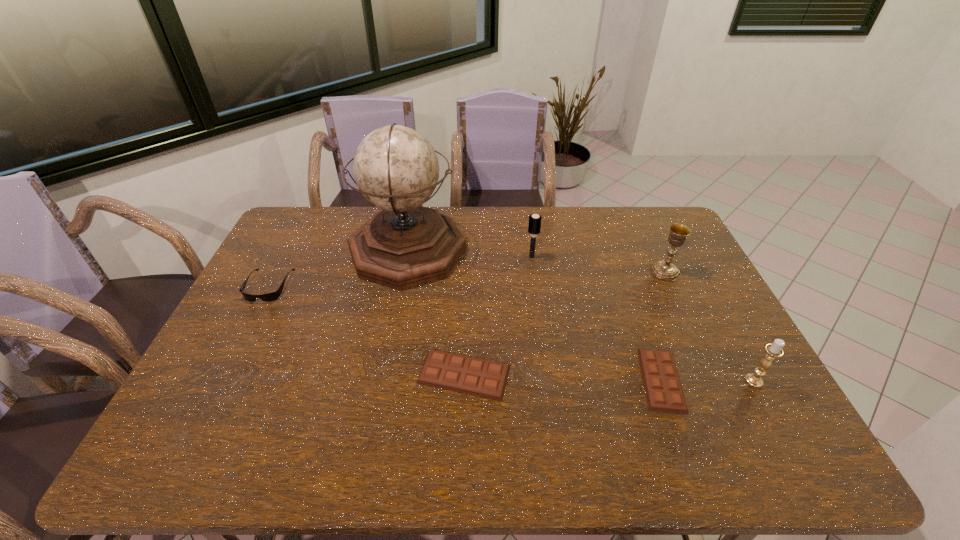
Given the evenly spaced chocolate bars in the image, where should an extra chocolate bar be added on the left to preserve the spacing? Please point to a vacant space. Please provide its 2D coordinates. Your answer should be formatted as a tuple, i.e. [(x, y)], where the tuple contains the x and y coordinates of a point satisfying the conditions above.

[(272, 369)]